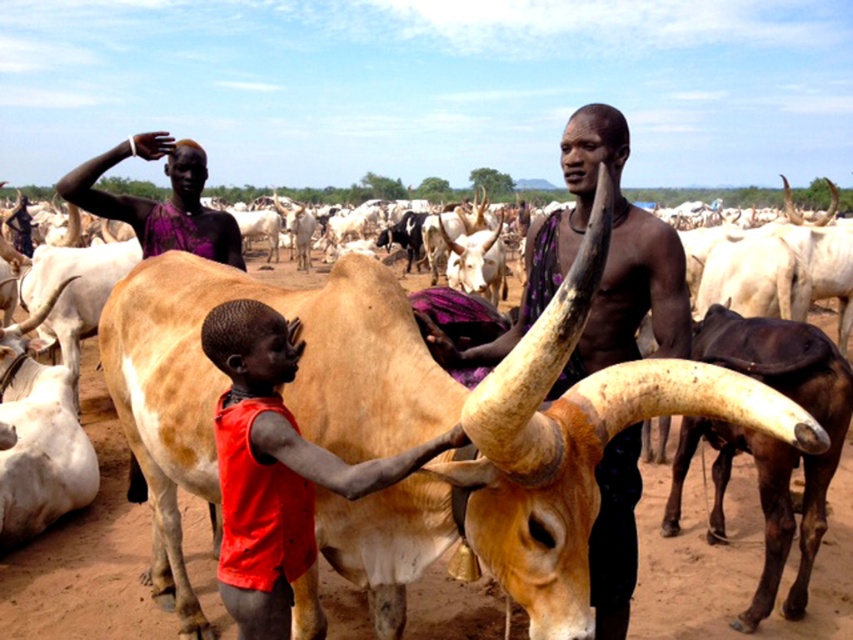
Question: Is matte purple shirt at center thinner than red sleeveless shirt at center?

Choices:
 (A) yes
 (B) no

Answer: (B)

Question: Observing the image, what is the correct spatial positioning of matte purple shirt at center in reference to red sleeveless shirt at center?

Choices:
 (A) above
 (B) below

Answer: (A)

Question: Which point is farther to the camera?

Choices:
 (A) (300, 500)
 (B) (131, 212)
 (C) (531, 273)

Answer: (B)

Question: Among these points, which one is nearest to the camera?

Choices:
 (A) (627, 349)
 (B) (212, 244)

Answer: (A)

Question: Which object is farther from the camera taking this photo?

Choices:
 (A) purple fabric at upper center
 (B) matte purple shirt at center

Answer: (A)

Question: Does red sleeveless shirt at center have a greater width compared to purple fabric at upper center?

Choices:
 (A) no
 (B) yes

Answer: (A)